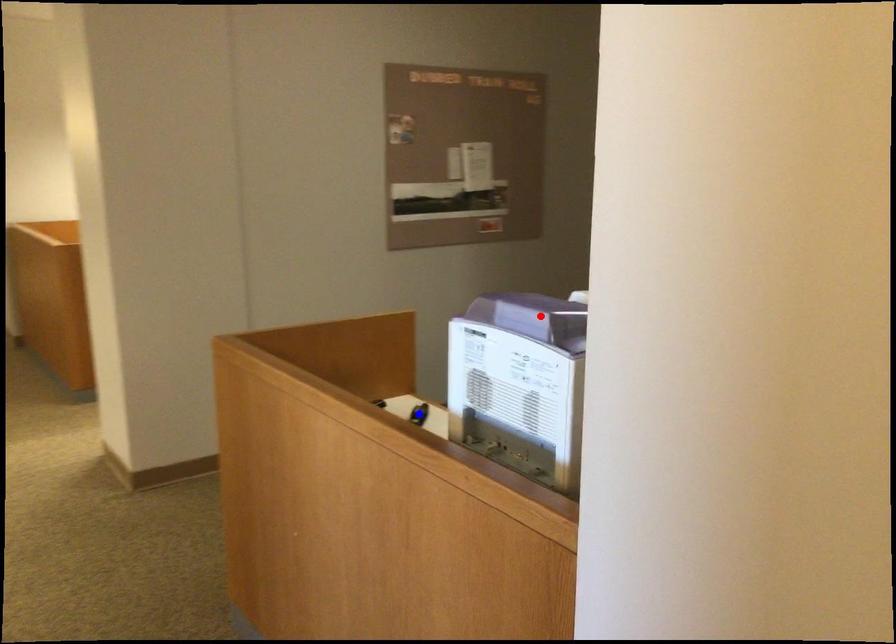
Question: Two points are marked on the image. Which point is closer to the camera?

Choices:
 (A) Blue point is closer.
 (B) Red point is closer.

Answer: (B)